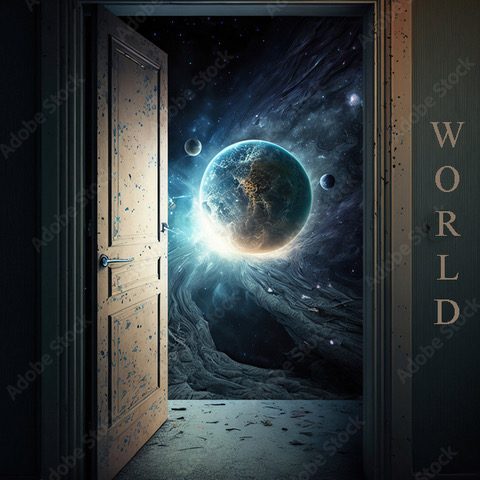
This screenshot has width=480, height=480. Find the location of `door handle`. door handle is located at coordinates (108, 258).